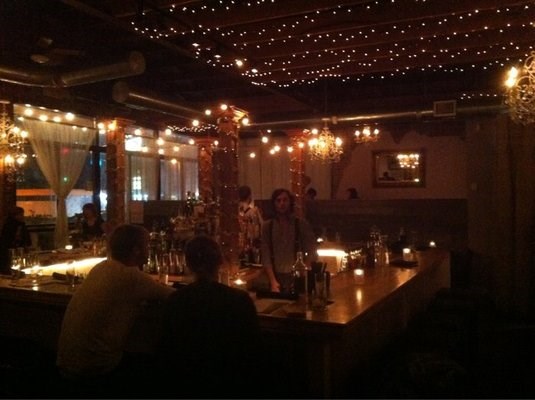
At what (x,y) coordinates should I click in order to perform the action: click on mirror. Please return your answer as a coordinate pair (x, y). The width and height of the screenshot is (535, 400). Looking at the image, I should click on (406, 165).